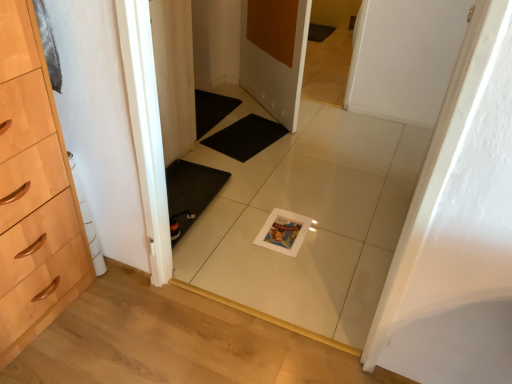
Question: Is white glossy tile at center taller or shorter than matte white door at center, which is counted as the first door, starting from the back?

Choices:
 (A) tall
 (B) short

Answer: (A)

Question: Is white glossy tile at center wider or thinner than matte white door at center, the 2th door from the right?

Choices:
 (A) thin
 (B) wide

Answer: (A)

Question: Estimate the real-world distances between objects in this image. Which object is closer to the white glossy tile at center?

Choices:
 (A) black rubber bath mat at center
 (B) matte white door at center, which is counted as the first door, starting from the back
 (C) white matte door at center, the 2th door from the left

Answer: (A)

Question: Which object is positioned closest to the matte white door at center, the 2th door from the right?

Choices:
 (A) white matte door at center, the 2th door from the left
 (B) black rubber bath mat at center
 (C) white glossy tile at center

Answer: (B)